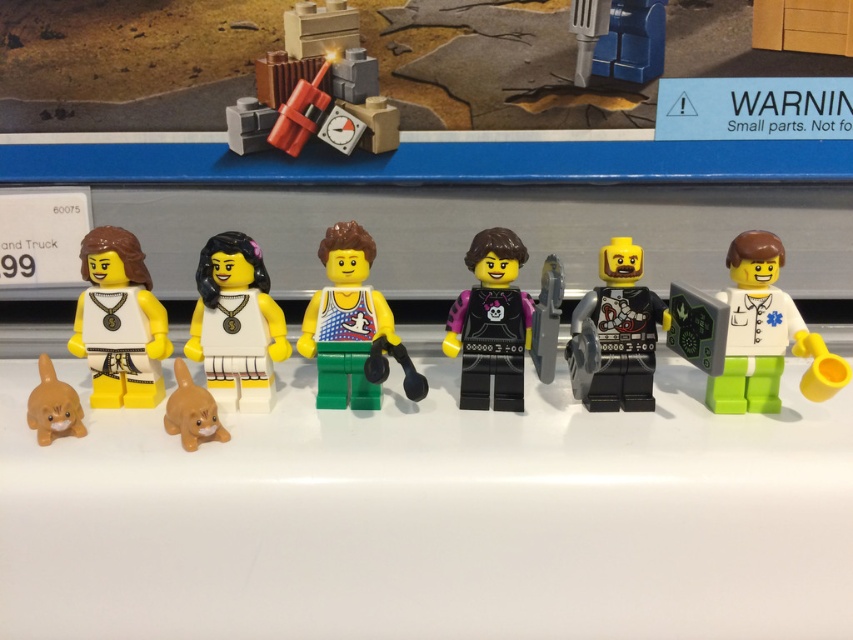
Question: Does white glossy minifigure at center have a smaller size compared to matte orange cat at lower left?

Choices:
 (A) yes
 (B) no

Answer: (B)

Question: Among these objects, which one is nearest to the camera?

Choices:
 (A) matte red explosive at upper center
 (B) black matte minifigure at center
 (C) white matte minifigure at left

Answer: (B)

Question: Which object is closer to the camera taking this photo?

Choices:
 (A) matte red explosive at upper center
 (B) white matte doctor at right

Answer: (B)

Question: In this image, where is matte red explosive at upper center located relative to matte orange cat at lower left?

Choices:
 (A) right
 (B) left

Answer: (A)

Question: Can you confirm if white matte doctor at right is positioned above white matte minifigure at left?

Choices:
 (A) no
 (B) yes

Answer: (A)

Question: Which point is farther to the camera?

Choices:
 (A) (630, 292)
 (B) (245, 380)

Answer: (B)